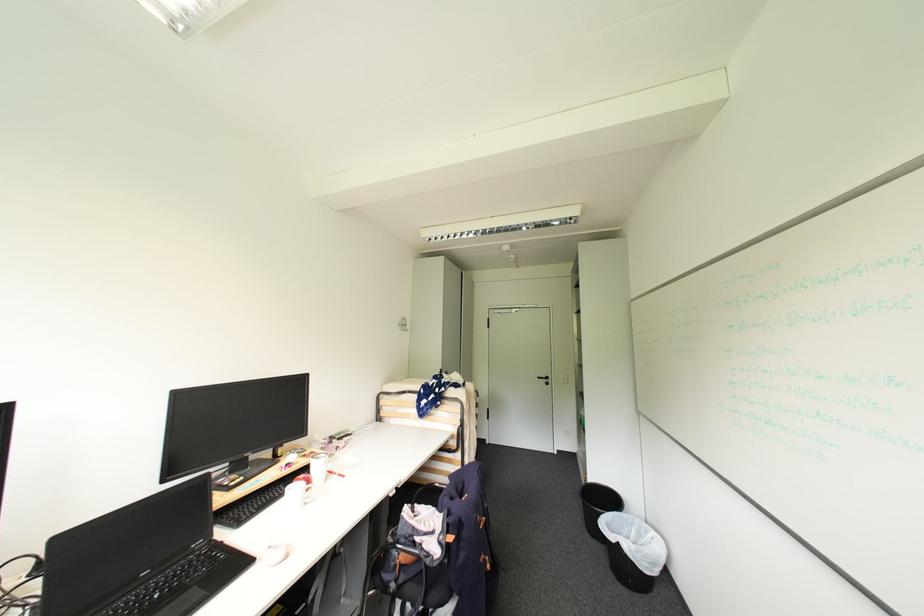
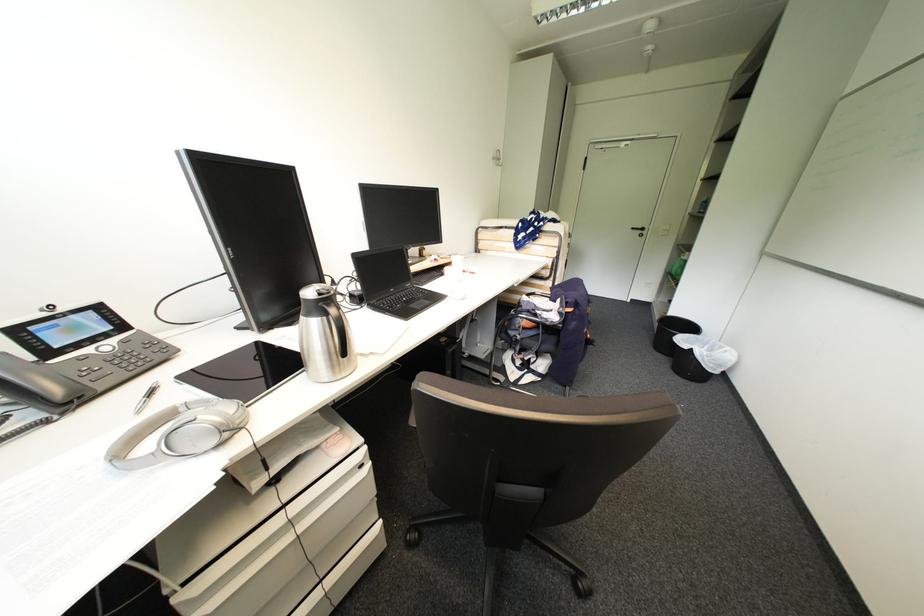
Locate, in the second image, the point that corresponds to (594,535) in the first image.

(660, 351)